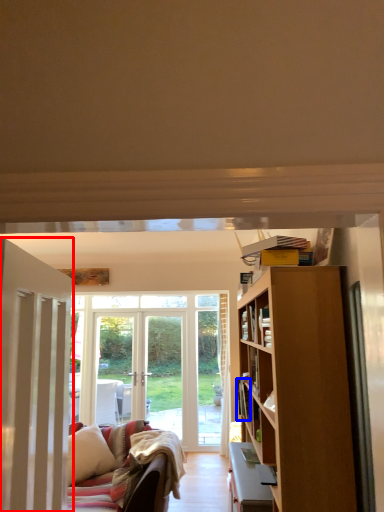
Question: Which of the following is the farthest to the observer, door (highlighted by a red box) or book (highlighted by a blue box)?

Choices:
 (A) door
 (B) book

Answer: (B)